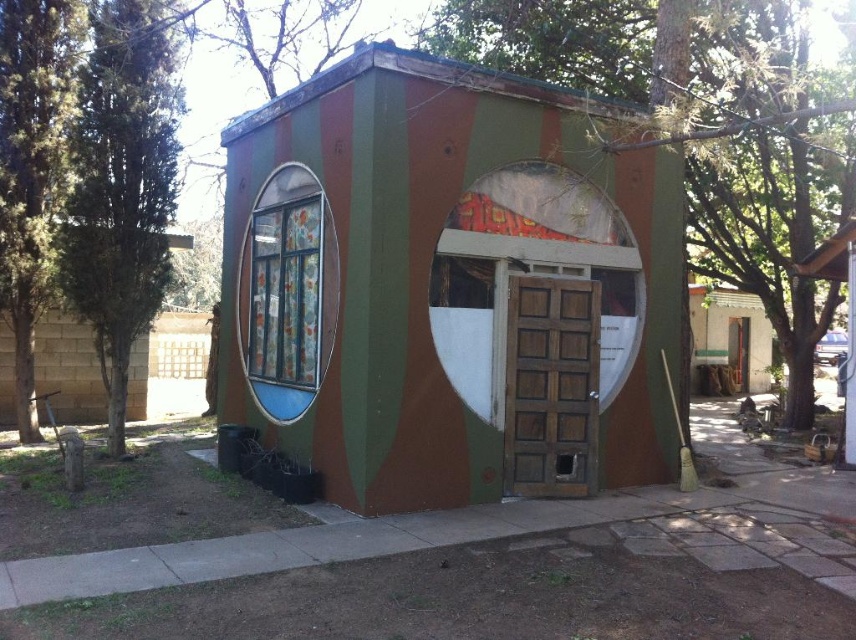
Question: Is camouflage paint hut at center closer to camera compared to white painted wood door at center?

Choices:
 (A) yes
 (B) no

Answer: (A)

Question: Considering the relative positions of camouflage paint hut at center and white painted wood door at center in the image provided, where is camouflage paint hut at center located with respect to white painted wood door at center?

Choices:
 (A) below
 (B) above

Answer: (B)

Question: Which object is farther from the camera taking this photo?

Choices:
 (A) camouflage paint hut at center
 (B) white painted wood door at center

Answer: (B)

Question: Which point appears closest to the camera in this image?

Choices:
 (A) (739, 310)
 (B) (524, 209)

Answer: (B)

Question: Can you confirm if camouflage paint hut at center is thinner than white painted wood door at center?

Choices:
 (A) no
 (B) yes

Answer: (A)